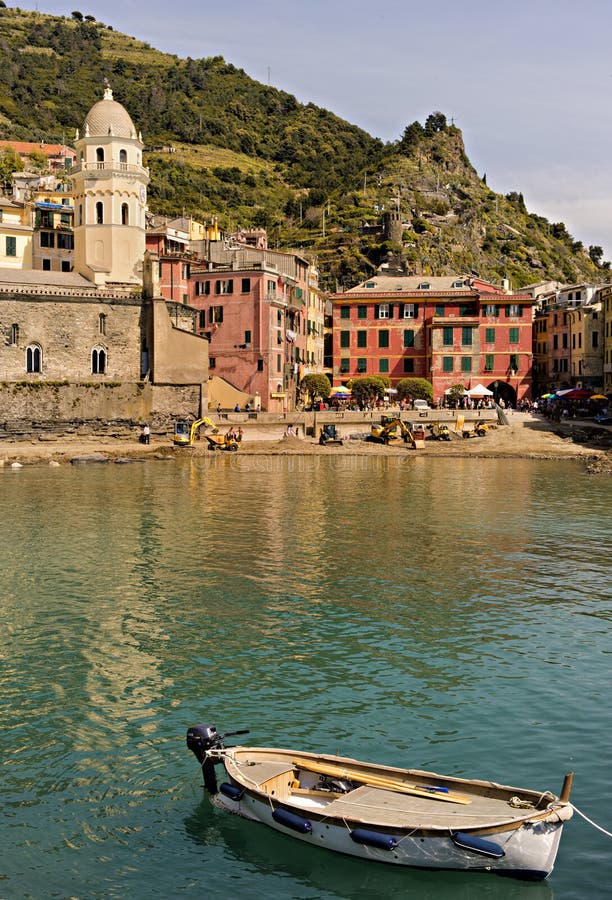
At what (x,y) coordinates should I click in order to perform the action: click on window. Please return your answer as a coordinate pair (x, y). The height and width of the screenshot is (900, 612). Looking at the image, I should click on (445, 334).